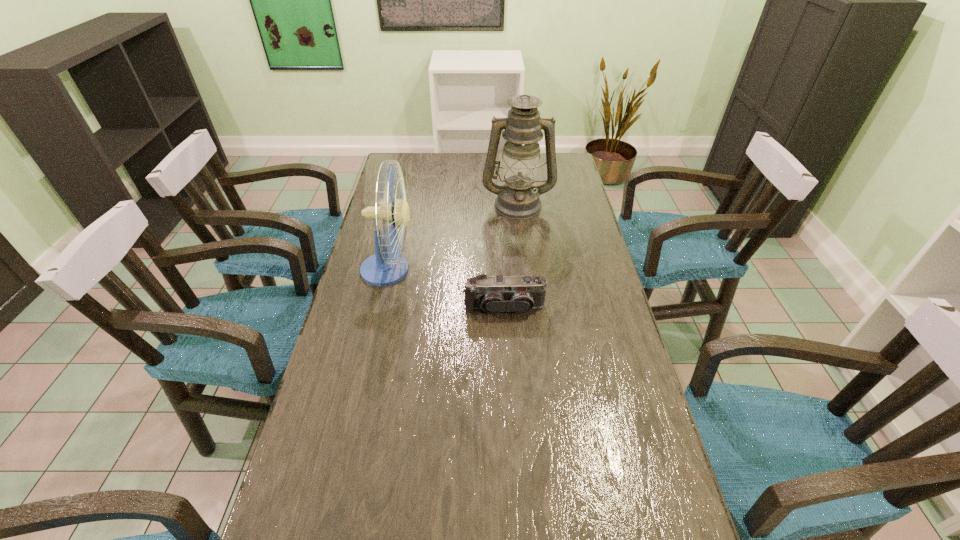
This screenshot has height=540, width=960. What are the coordinates of `the farthest object` in the screenshot? It's located at (518, 198).

The width and height of the screenshot is (960, 540). Identify the location of fan. (384, 268).

Where is `the shortest object`? The height and width of the screenshot is (540, 960). the shortest object is located at coordinates (493, 294).

Where is `free space located on the left of the farthest object`? free space located on the left of the farthest object is located at coordinates (440, 204).

Locate an element on the screen. vacant space located at the front of the fan where the blades are visible is located at coordinates (489, 269).

You are a GUI agent. You are given a task and a screenshot of the screen. Output one action in this format:
    pyautogui.click(x=<x>, y=<y>)
    Task: Click on the vacant area situated on the front-facing side of the camcorder
    The width and height of the screenshot is (960, 540).
    Given the screenshot: What is the action you would take?
    509,389

This screenshot has width=960, height=540. What are the coordinates of `object that is positioned at the left edge` in the screenshot? It's located at (384, 268).

I want to click on object located at the right edge, so click(518, 198).

Identify the location of vacant region at the left edge of the desktop. (369, 334).

Identify the location of vacant space at the right edge of the desktop. (611, 417).